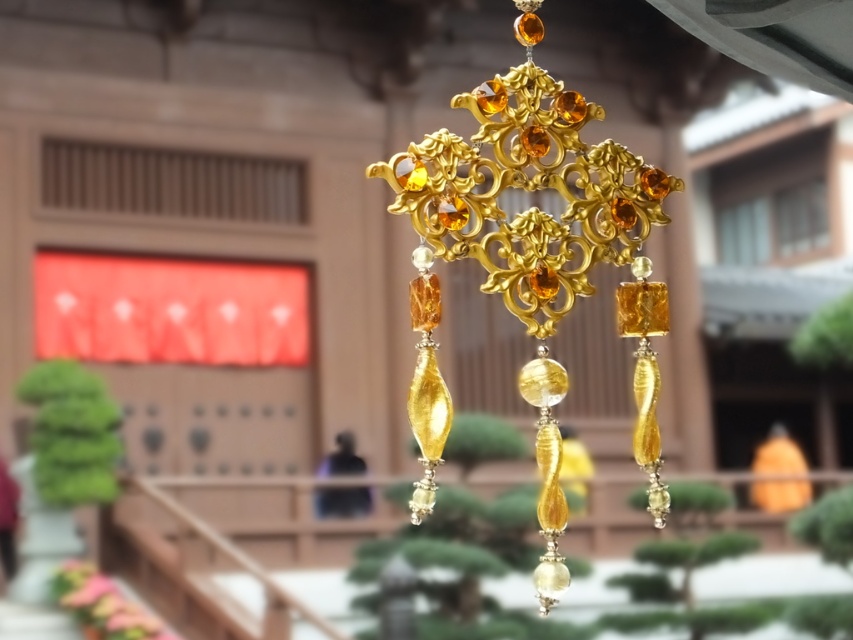
Question: Considering the relative positions of gold metallic cross at center and matte pink flower at lower left in the image provided, where is gold metallic cross at center located with respect to matte pink flower at lower left?

Choices:
 (A) right
 (B) left

Answer: (A)

Question: Is the position of gold metallic cross at center more distant than that of matte pink flower at lower left?

Choices:
 (A) no
 (B) yes

Answer: (A)

Question: Which of the following is the farthest from the observer?

Choices:
 (A) (83, 618)
 (B) (602, 237)

Answer: (A)

Question: Can you confirm if gold metallic cross at center is wider than matte pink flower at lower left?

Choices:
 (A) yes
 (B) no

Answer: (A)

Question: Among these objects, which one is farthest from the camera?

Choices:
 (A) gold metallic cross at center
 (B) matte pink flower at lower left

Answer: (B)